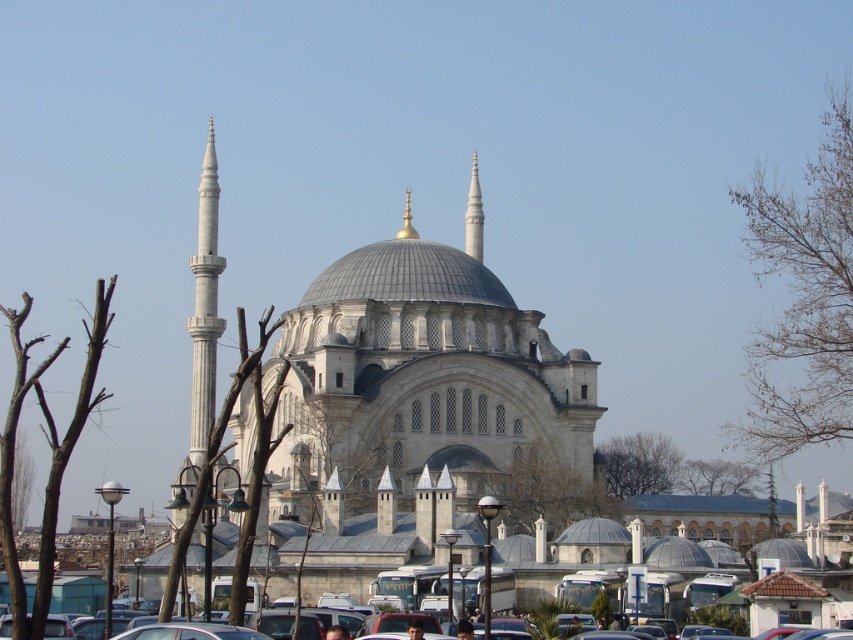
Is bare branches at upper right bigger than brown leafy tree at center?

Correct, bare branches at upper right is larger in size than brown leafy tree at center.

Does point (757, 244) come closer to viewer compared to point (558, 531)?

No, (757, 244) is further to viewer.

Which is behind, point (850, 308) or point (541, 483)?

The point (541, 483) is behind.

You are a GUI agent. You are given a task and a screenshot of the screen. Output one action in this format:
    pyautogui.click(x=<x>, y=<y>)
    Task: Click on the bare branches at upper right
    
    Given the screenshot: What is the action you would take?
    pyautogui.click(x=802, y=296)

Does green leafy tree at center appear under brown bark tree at left?

Actually, green leafy tree at center is above brown bark tree at left.

Is green leafy tree at center closer to camera compared to brown bark tree at left?

Yes, green leafy tree at center is closer to the viewer.

Does point (605, 442) come behind point (33, 477)?

No, (605, 442) is in front of (33, 477).

You are a GUI agent. You are given a task and a screenshot of the screen. Output one action in this format:
    pyautogui.click(x=<x>, y=<y>)
    Task: Click on the green leafy tree at center
    The height and width of the screenshot is (640, 853).
    Given the screenshot: What is the action you would take?
    pyautogui.click(x=640, y=464)

Who is taller, bare branches at upper right or matte black car at center?

bare branches at upper right

Is bare branches at upper right bigger than matte black car at center?

Yes, bare branches at upper right is bigger than matte black car at center.

Is point (825, 442) positioned behind point (274, 618)?

Yes.

You are a GUI agent. You are given a task and a screenshot of the screen. Output one action in this format:
    pyautogui.click(x=<x>, y=<y>)
    Task: Click on the bare branches at upper right
    The height and width of the screenshot is (640, 853).
    Given the screenshot: What is the action you would take?
    pyautogui.click(x=802, y=296)